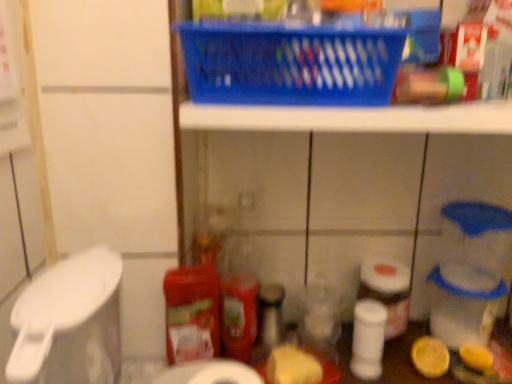
Question: In terms of size, does white matte toilet paper at center, acting as the second toilet paper starting from the right, appear bigger or smaller than white matte toilet paper at lower right, the third toilet paper viewed from the front?

Choices:
 (A) big
 (B) small

Answer: (A)

Question: Considering their positions, is white matte toilet paper at center, which is the 2th toilet paper from back to front, located in front of or behind white matte toilet paper at lower right, which is the 3th toilet paper from left to right?

Choices:
 (A) behind
 (B) front

Answer: (B)

Question: Based on their relative distances, which object is nearer to the yellow matte cheese at center?

Choices:
 (A) white matte toilet paper at lower right, the third toilet paper viewed from the front
 (B) yellow matte lemon at lower right
 (C) white matte toilet paper at center, positioned as the 2th toilet paper in left-to-right order
 (D) matte red plastic bottle at center
 (E) white matte toilet paper at lower center, arranged as the third toilet paper when viewed from the back

Answer: (D)

Question: Which of these objects is positioned farthest from the white matte toilet paper at lower right, placed as the first toilet paper when sorted from back to front?

Choices:
 (A) matte red plastic bottle at center
 (B) white matte toilet paper at lower center, arranged as the 1th toilet paper when viewed from the front
 (C) white matte toilet paper at center, the second toilet paper positioned from the front
 (D) yellow matte lemon at lower right
 (E) yellow matte cheese at center

Answer: (B)